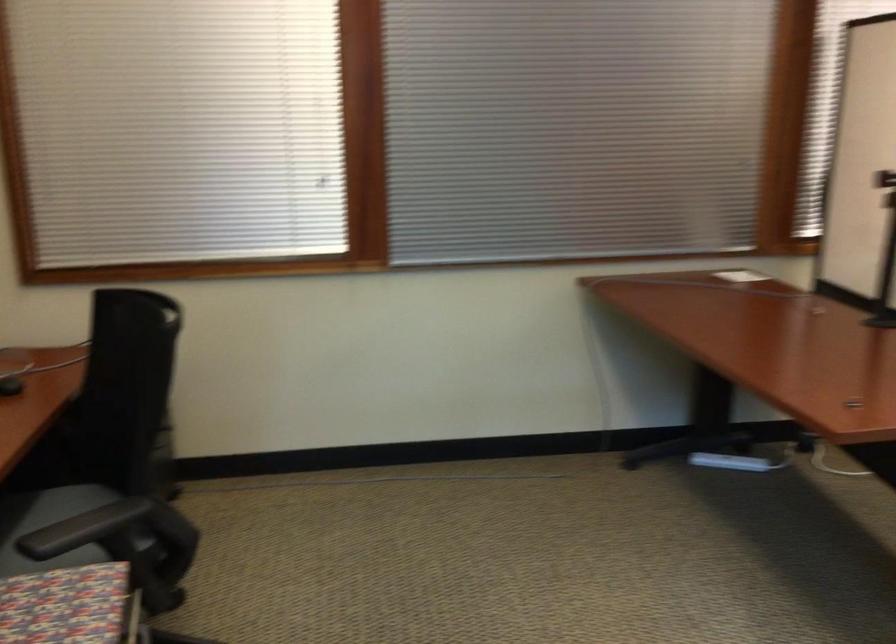
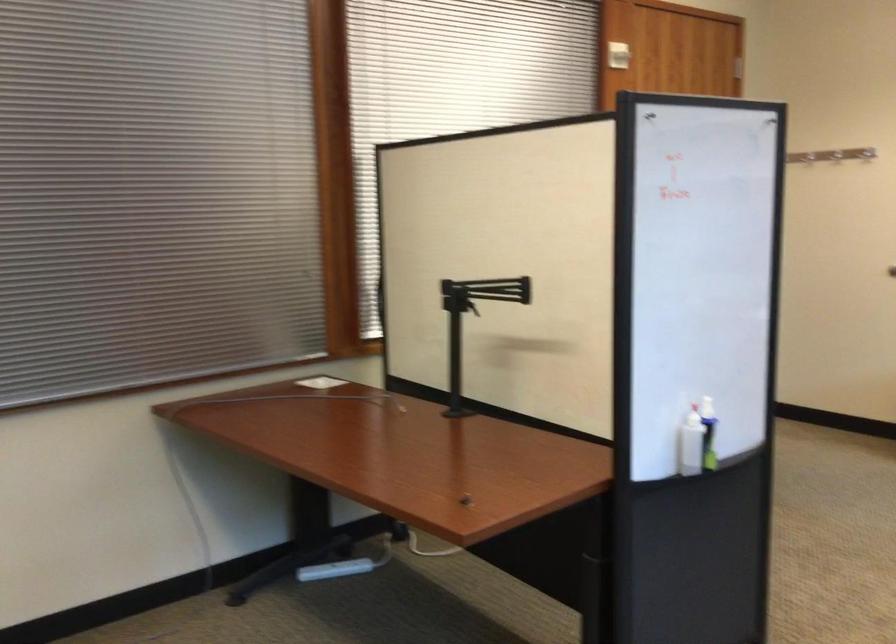
Question: The first image is from the beginning of the video and the second image is from the end. How did the camera likely rotate when shooting the video?

Choices:
 (A) Left
 (B) Right
 (C) Up
 (D) Down

Answer: (B)